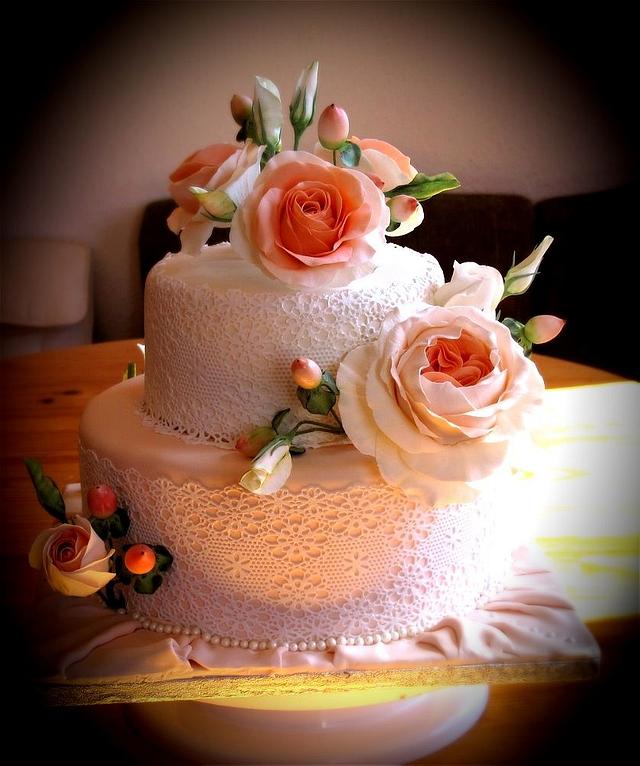
Find the location of a particular element. halo area back wall is located at coordinates (600, 161), (470, 41), (161, 25), (26, 205).